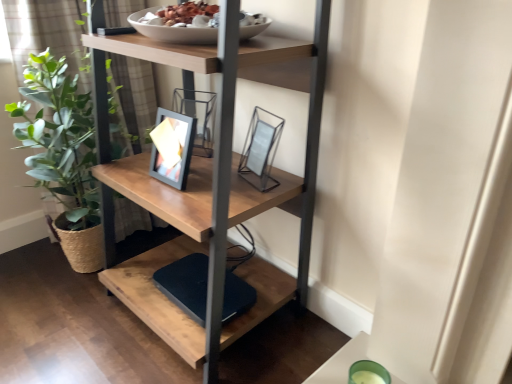
Locate an element on the screen. free point above black matte lift at lower center (from a real-world perspective) is located at coordinates (192, 284).